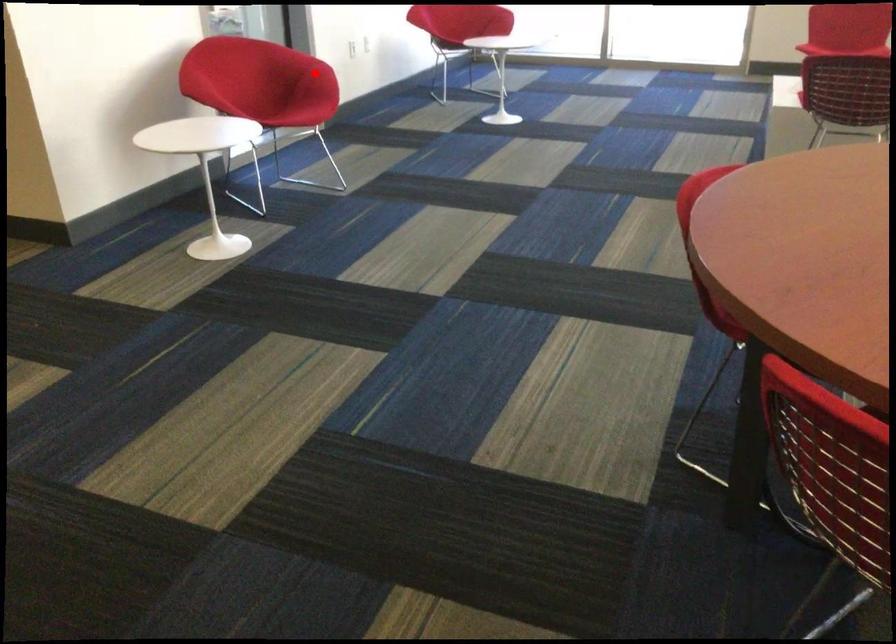
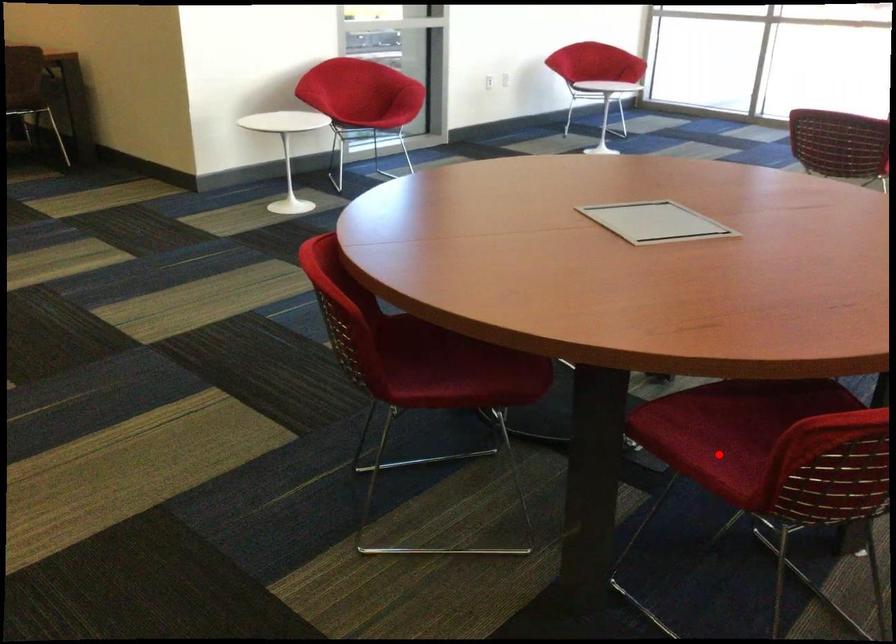
I am providing you with two images of the same scene from different viewpoints. A red point is marked on the first image and another point is marked on the second image. Is the red point in image1 aligned with the point shown in image2?

No